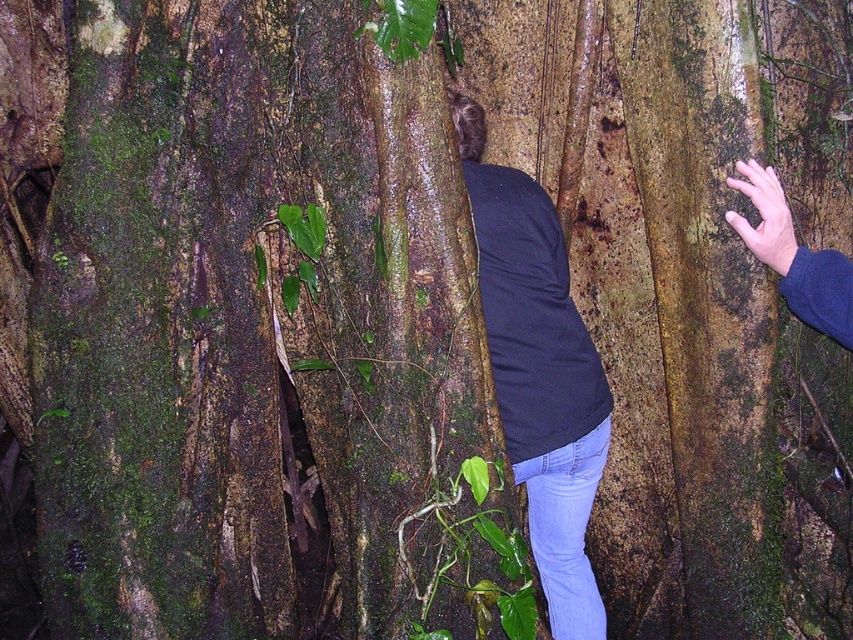
Which is below, dark blue shirt at center or blue fabric hand at right?

Positioned lower is dark blue shirt at center.

Is point (531, 440) closer to camera compared to point (759, 168)?

No, it is behind (759, 168).

Who is more distant from viewer, (500,259) or (753,228)?

The point (500,259) is more distant.

Identify the location of dark blue shirt at center. (538, 372).